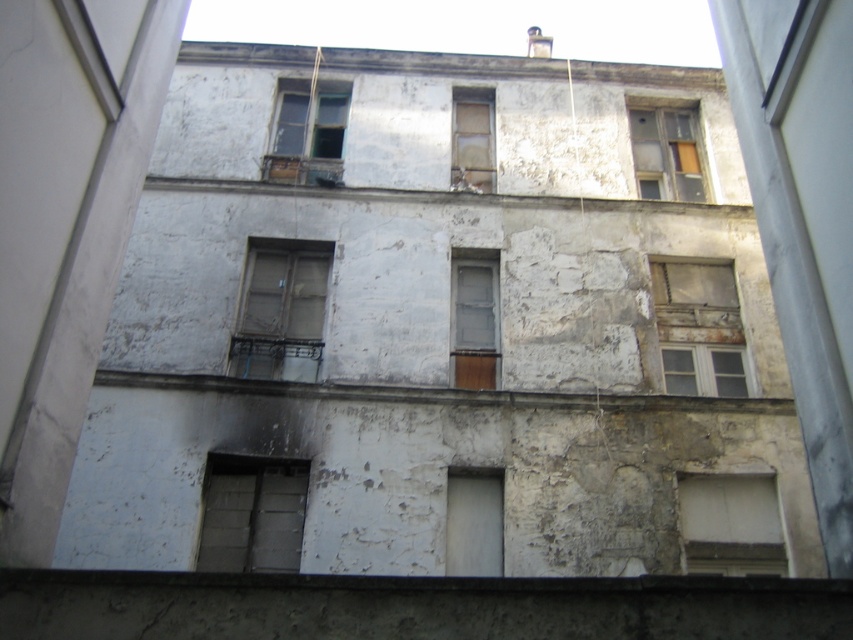
You are a window repair technician standing at the base of the building. You need to reach both the gray concrete window at center and the weathered wood window at upper right. Which window is closer to you?

The gray concrete window at center is closer to you than the weathered wood window at upper right because they are 6.42 meters apart.

From the picture: You are a delivery person trying to enter the building. You see the white matte door at center and the matte glass window at center. Which one should you approach to deliver the package?

You should approach the white matte door at center because doors are typically used for entry, whereas windows are not meant for entering or delivering packages.